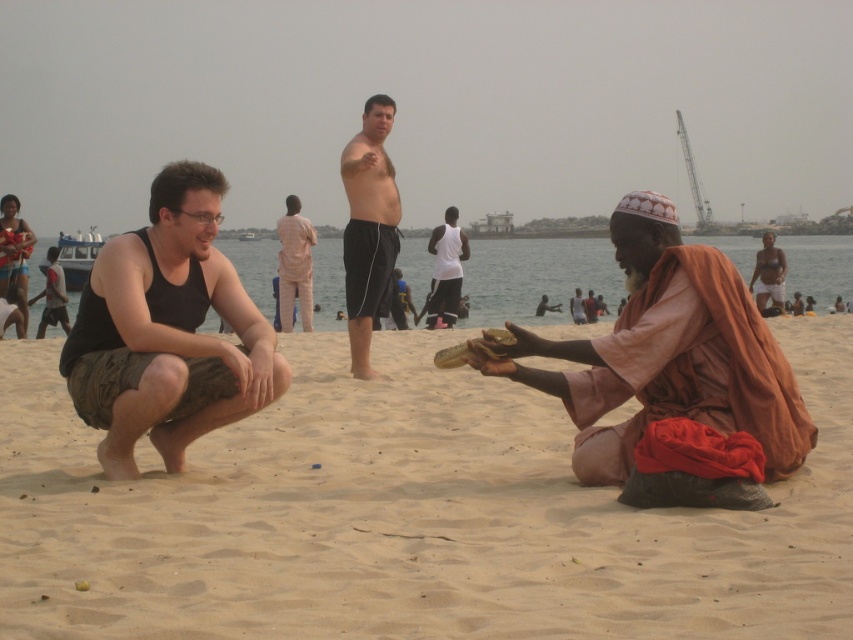
Question: Which point appears closest to the camera in this image?

Choices:
 (A) (363, 376)
 (B) (828, 596)
 (C) (440, 228)

Answer: (B)

Question: Which of these objects is positioned farthest from the black cotton tank top at left?

Choices:
 (A) smooth skin man at right
 (B) shiny black shorts at center
 (C) light brown fabric pants at center
 (D) black cotton shorts at center

Answer: (A)

Question: In this image, where is shiny black shorts at center located relative to white matte shirt at center?

Choices:
 (A) below
 (B) above

Answer: (A)

Question: Can you confirm if sandy at lower center is positioned below shiny black shorts at center?

Choices:
 (A) no
 (B) yes

Answer: (B)

Question: Based on their relative distances, which object is farther from the orange fabric cloth at lower right?

Choices:
 (A) shiny black shorts at center
 (B) black cotton shorts at center
 (C) sandy at lower center
 (D) white matte shirt at center

Answer: (D)

Question: In this image, where is shiny black shorts at center located relative to black cotton shorts at center?

Choices:
 (A) below
 (B) above

Answer: (A)